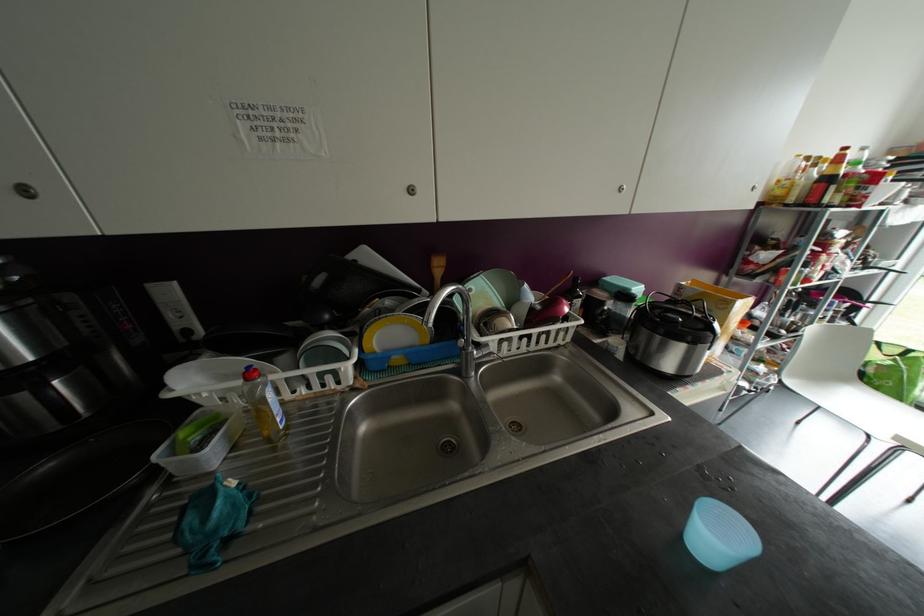
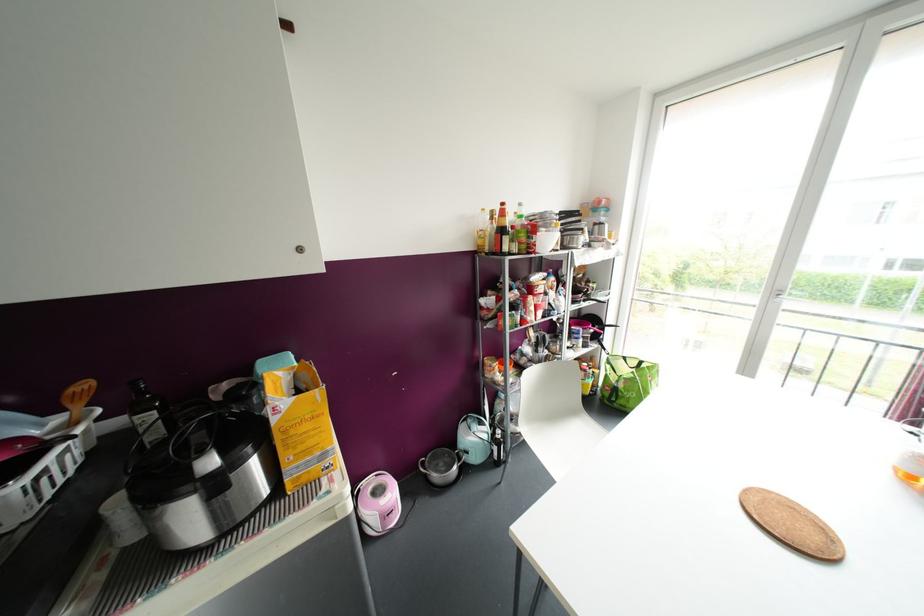
Locate, in the second image, the point that corresponds to the point at 845,148 in the first image.

(502, 204)